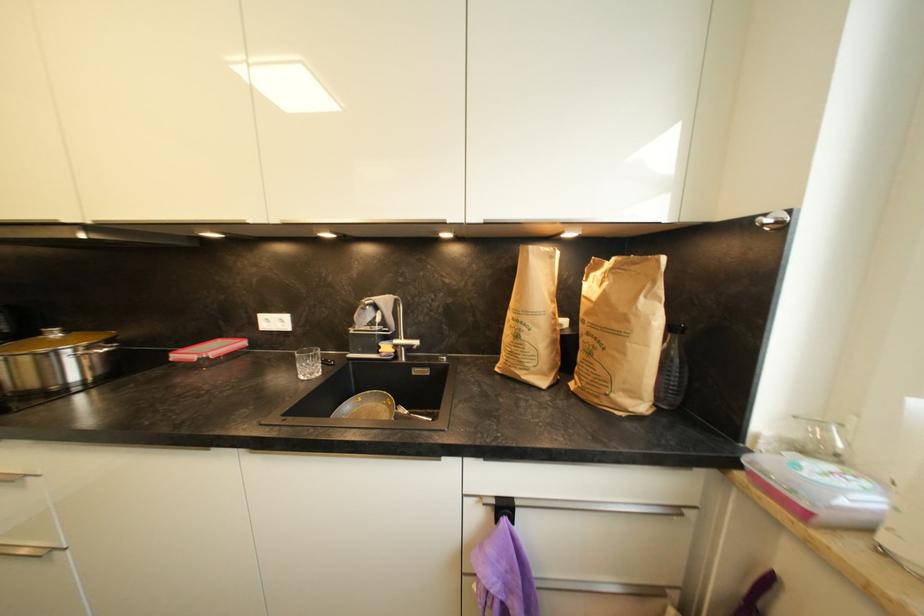
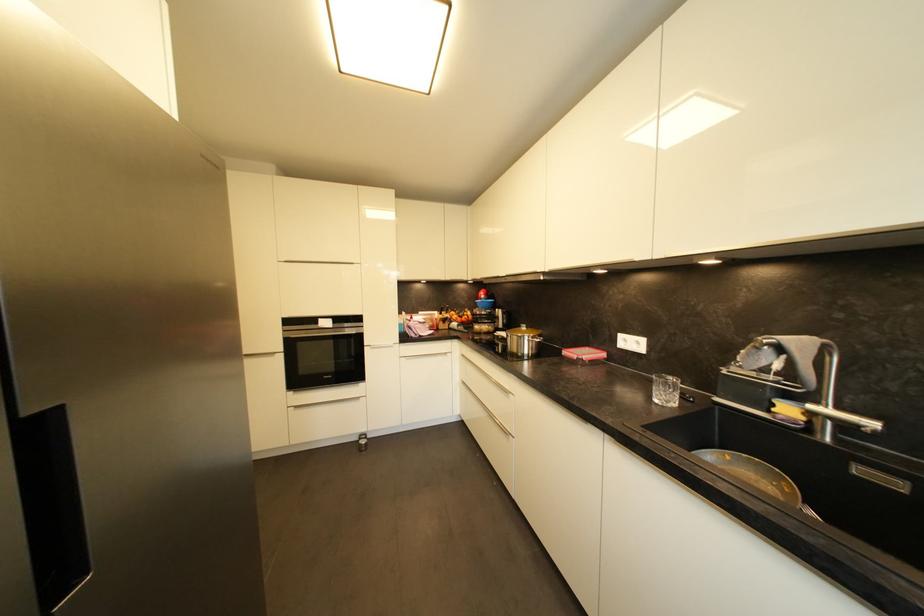
Where in the second image is the point corresponding to [306,379] from the first image?

(661, 403)